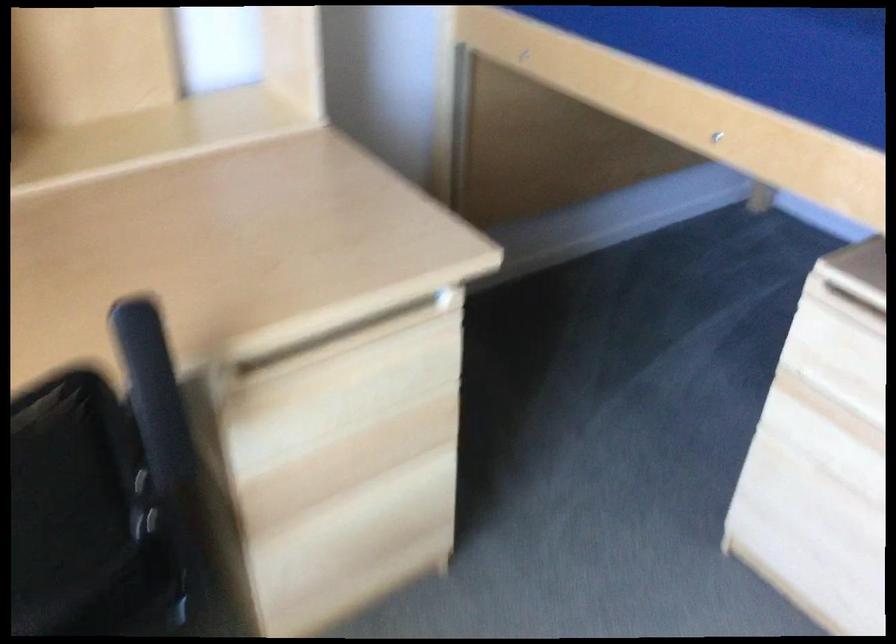
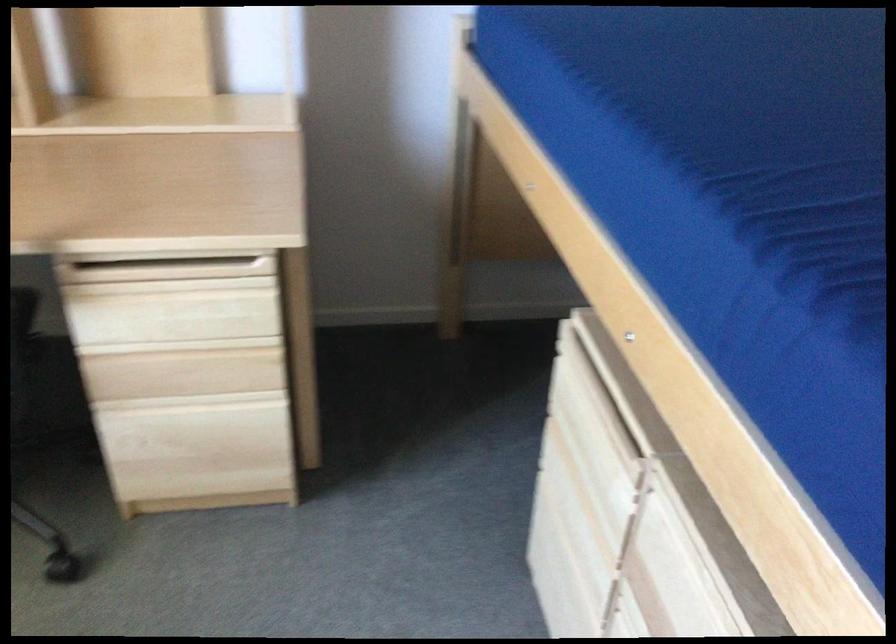
Locate, in the second image, the point that corresponds to the point at 365,428 in the first image.

(179, 346)